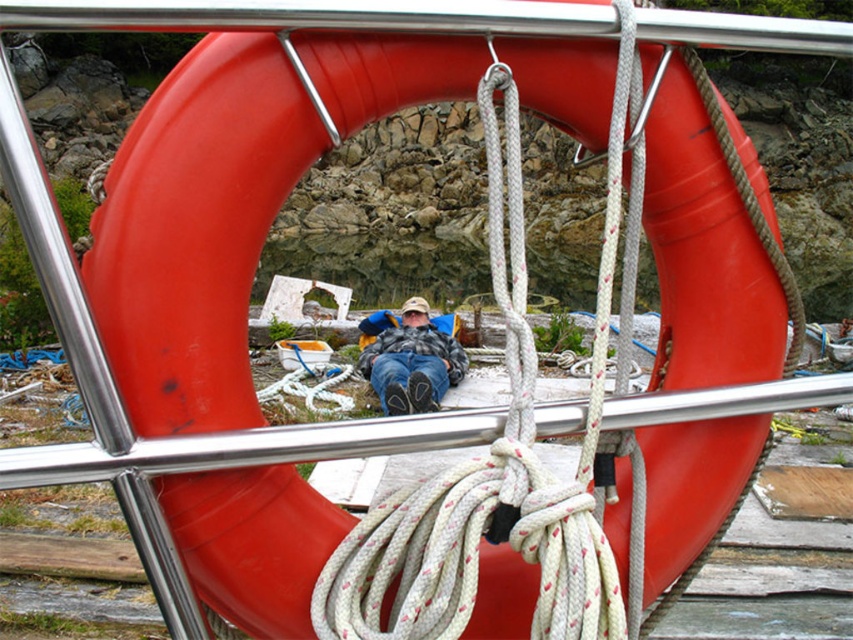
You are navigating a boat and need to secure a new rope. You have a white textured rope at center and a red lifebuoy in the foreground. Which object is closer to the boat railing?

The red lifebuoy in the foreground is closer to the boat railing because it is prominently displayed in the foreground, while the white textured rope at center is located at point (500, 461) which might be further away.

Looking at this image, you are a sailor on the boat and need to secure the white textured rope at center to the flannel shirt at center. Can you loop the rope around the shirt?

The white textured rope at center is thinner than the flannel shirt at center, so yes, the sailor can loop the white textured rope at center around the flannel shirt at center since it is thinner and can pass through the shirt material.